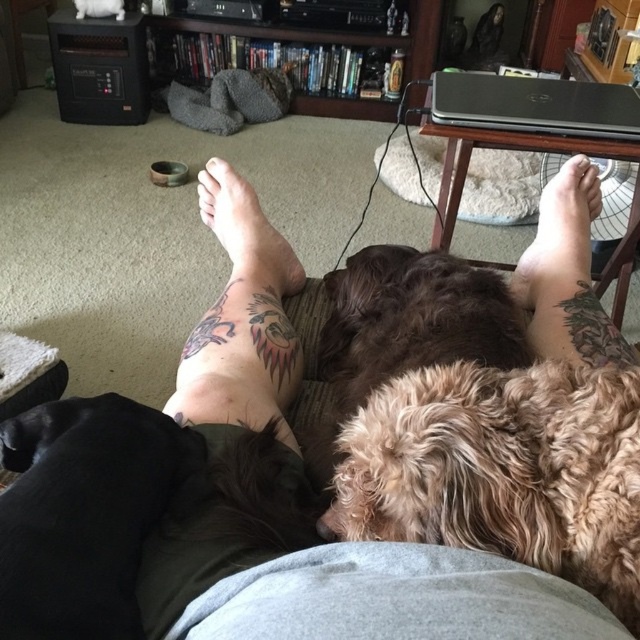
Question: Which object appears farthest from the camera in this image?

Choices:
 (A) brown furry foot at upper right
 (B) brown fluffy dog at center
 (C) black fur dog at lower left
 (D) pale skin at center

Answer: (D)

Question: Which is nearer to the brown fur at center?

Choices:
 (A) fuzzy brown dog at center
 (B) pale skin at center
 (C) brown fluffy dog at center
 (D) black fur dog at lower left

Answer: (A)

Question: Which of these objects is positioned farthest from the brown fluffy dog at center?

Choices:
 (A) pale skin at center
 (B) brown furry foot at upper right
 (C) brown fur at center

Answer: (C)

Question: Is black fur dog at lower left smaller than brown fur at center?

Choices:
 (A) yes
 (B) no

Answer: (A)

Question: Does brown fluffy dog at center have a lesser width compared to brown furry foot at upper right?

Choices:
 (A) yes
 (B) no

Answer: (B)

Question: Does fuzzy brown dog at center appear over pale skin at center?

Choices:
 (A) yes
 (B) no

Answer: (B)